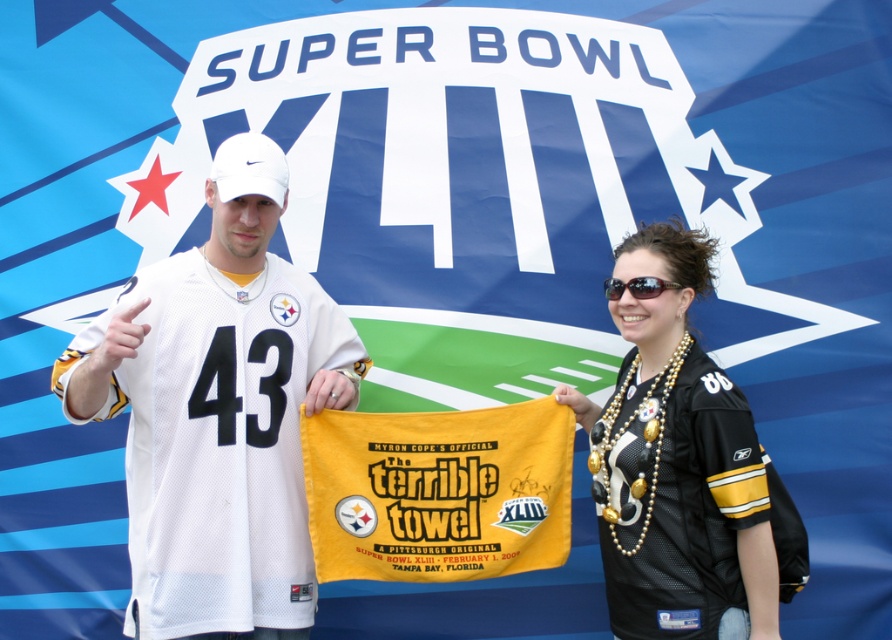
Question: Can you confirm if white jersey at center is positioned above black jersey at center?

Choices:
 (A) yes
 (B) no

Answer: (A)

Question: Does black jersey at center lie in front of black plastic sunglasses at upper center?

Choices:
 (A) yes
 (B) no

Answer: (A)

Question: Is white jersey at center positioned before black plastic sunglasses at upper center?

Choices:
 (A) yes
 (B) no

Answer: (A)

Question: Which of these objects is positioned farthest from the black plastic sunglasses at upper center?

Choices:
 (A) black jersey at center
 (B) white jersey at center

Answer: (B)

Question: Considering the real-world distances, which object is closest to the black jersey at center?

Choices:
 (A) black plastic sunglasses at upper center
 (B) white jersey at center

Answer: (A)

Question: Which object is closer to the camera taking this photo?

Choices:
 (A) black jersey at center
 (B) black plastic sunglasses at upper center

Answer: (A)